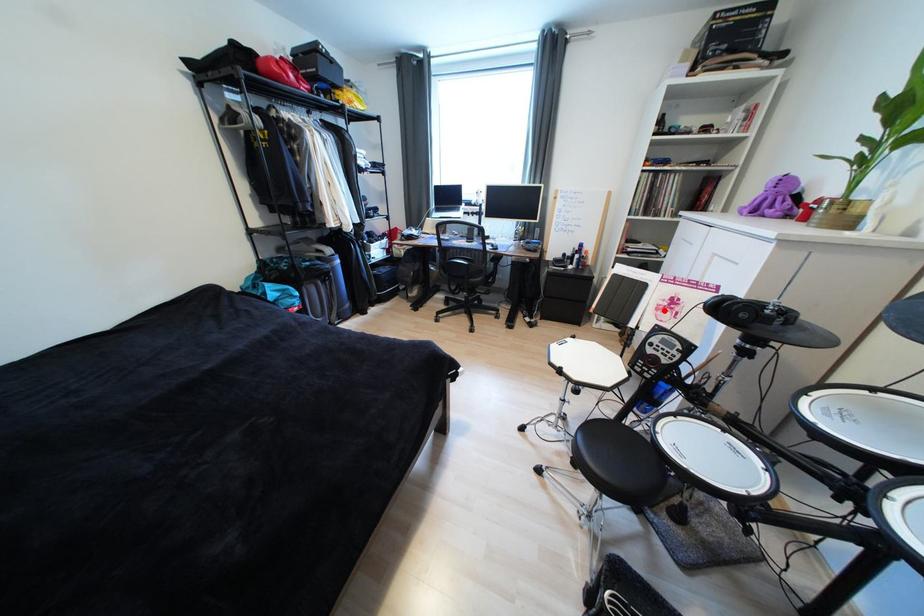
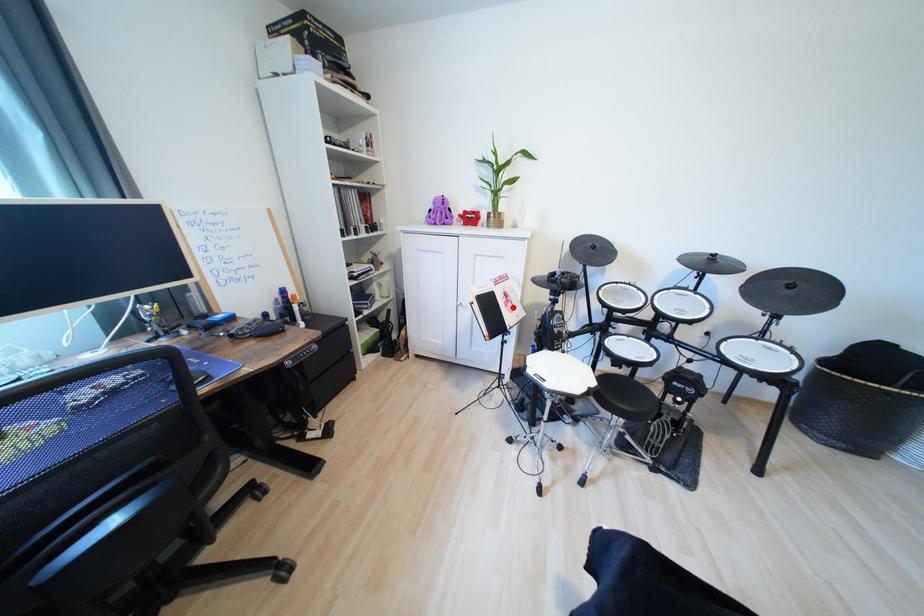
I am providing you with two images of the same scene from different viewpoints. A red point is marked on the first image and another point is marked on the second image. Are the points marked in image1 and image2 representing the same 3D position?

Yes